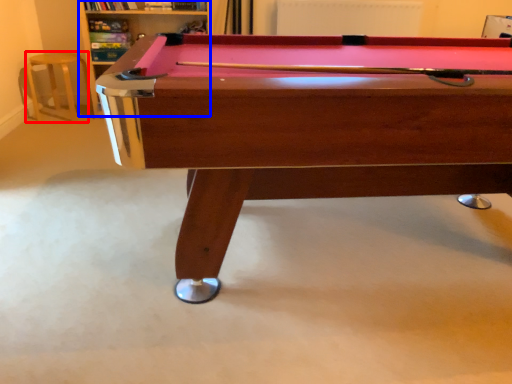
Question: Which of the following is the closest to the observer, bar stool (highlighted by a red box) or shelf (highlighted by a blue box)?

Choices:
 (A) bar stool
 (B) shelf

Answer: (B)